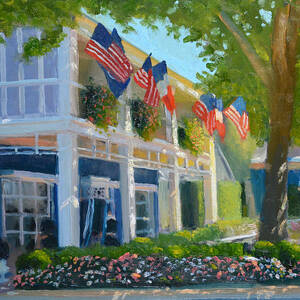
You are a GUI agent. You are given a task and a screenshot of the screen. Output one action in this format:
    pyautogui.click(x=<x>, y=<y>)
    Task: Click on the curtains
    Image resolution: width=300 pixels, height=300 pixels.
    Given the screenshot: What is the action you would take?
    pyautogui.click(x=87, y=222), pyautogui.click(x=104, y=226)